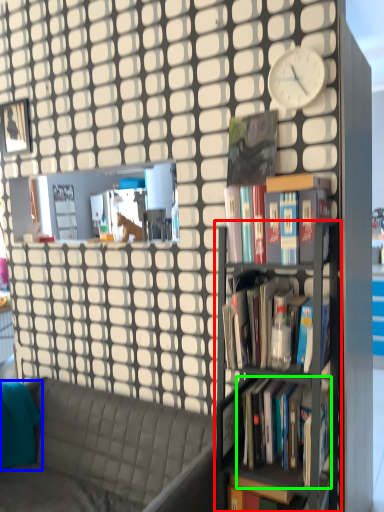
Question: Which object is the closest to the bookshelf (highlighted by a red box)? Choose among these: pillow (highlighted by a blue box) or book (highlighted by a green box).

Choices:
 (A) pillow
 (B) book

Answer: (B)